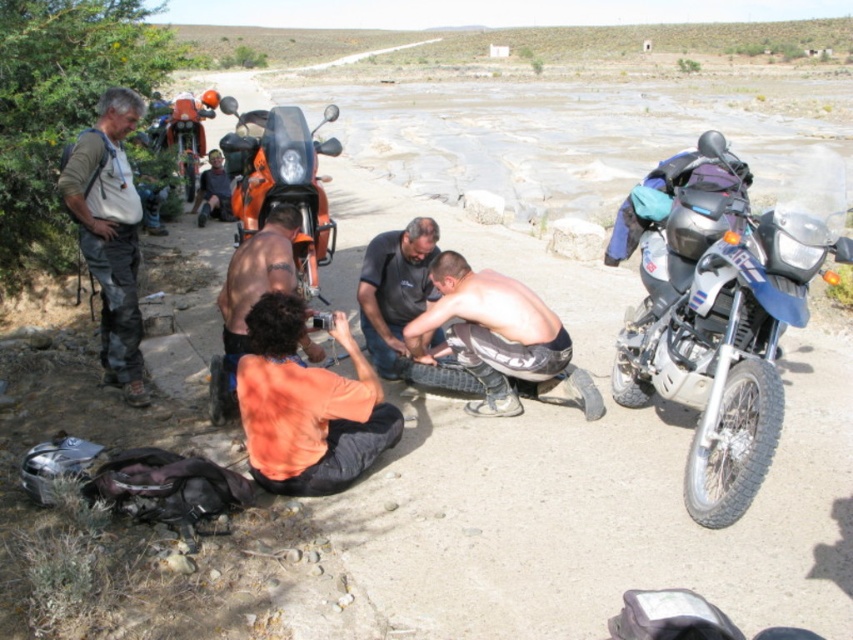
You are a photographer positioned at the camera location. You want to capture both point (755,433) and point (106,138) in your shot. Which point will appear larger in your photo?

Point (755,433) is closer to the camera than point (106,138), so it will appear larger in the photo.